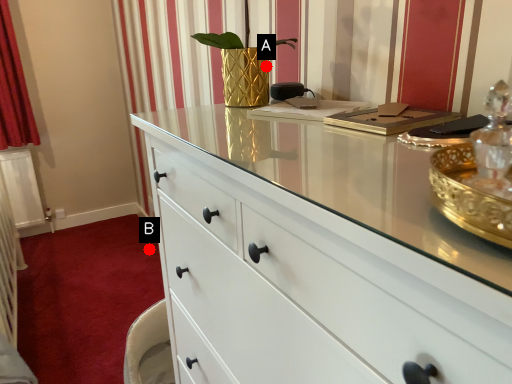
Question: Two points are circled on the image, labeled by A and B beside each circle. Which of the following is the closest to the observer?

Choices:
 (A) A is closer
 (B) B is closer

Answer: (A)